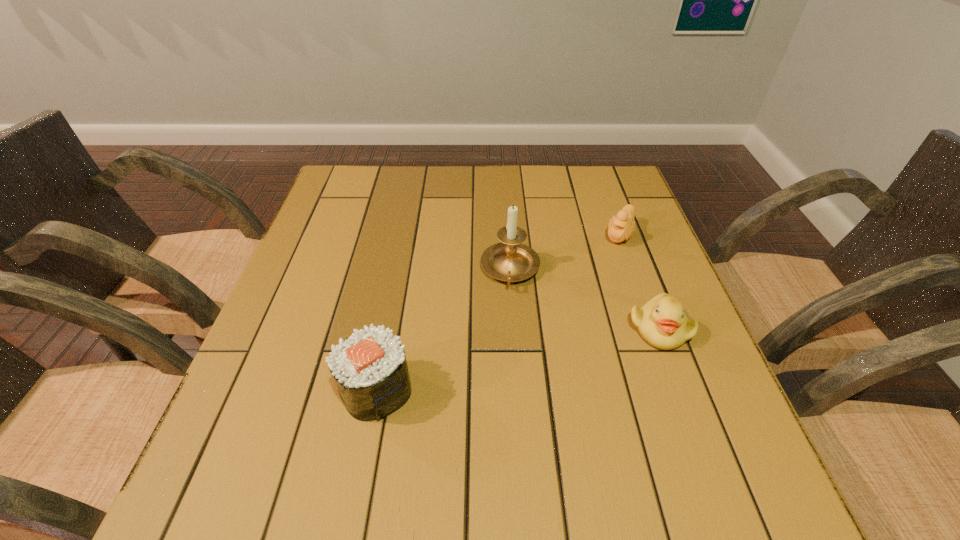
You are a GUI agent. You are given a task and a screenshot of the screen. Output one action in this format:
    pyautogui.click(x=<x>, y=<y>)
    Task: Click on the free spot on the desktop that is between the third shortest object and the nearer duckling and is positioned on the face of the farther duckling
    
    Given the screenshot: What is the action you would take?
    pyautogui.click(x=557, y=350)

Image resolution: width=960 pixels, height=540 pixels. Find the location of `free spot on the desktop that is between the leftmost object and the nearer duckling and is positioned with a handle on the side of the candle holder`. free spot on the desktop that is between the leftmost object and the nearer duckling and is positioned with a handle on the side of the candle holder is located at coordinates (512, 360).